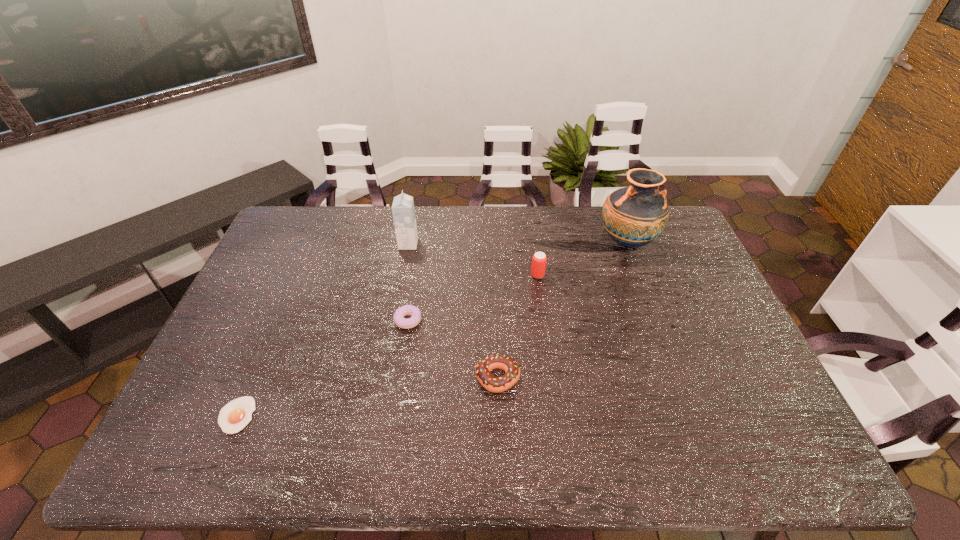
Identify the location of the rightmost object. [x=633, y=216].

Find the location of a particular element. The height and width of the screenshot is (540, 960). the tallest object is located at coordinates (633, 216).

I want to click on carton, so click(403, 211).

Find the location of a particular element. The height and width of the screenshot is (540, 960). the fourth nearest object is located at coordinates (539, 259).

Locate an element on the screen. the second object from right to left is located at coordinates (539, 259).

Where is `the taller doughnut`? the taller doughnut is located at coordinates (494, 384).

You are a GUI agent. You are given a task and a screenshot of the screen. Output one action in this format:
    pyautogui.click(x=<x>, y=<y>)
    Task: Click on the nearer doughnut
    This screenshot has width=960, height=540.
    Given the screenshot: What is the action you would take?
    pyautogui.click(x=494, y=384)

You are a GUI agent. You are given a task and a screenshot of the screen. Output one action in this format:
    pyautogui.click(x=<x>, y=<y>)
    Task: Click on the shorter doughnut
    This screenshot has width=960, height=540.
    Given the screenshot: What is the action you would take?
    pyautogui.click(x=404, y=323)

What are the coordinates of `the third nearest object` in the screenshot? It's located at (404, 323).

Where is `egg yolk`? Image resolution: width=960 pixels, height=540 pixels. egg yolk is located at coordinates tap(234, 416).